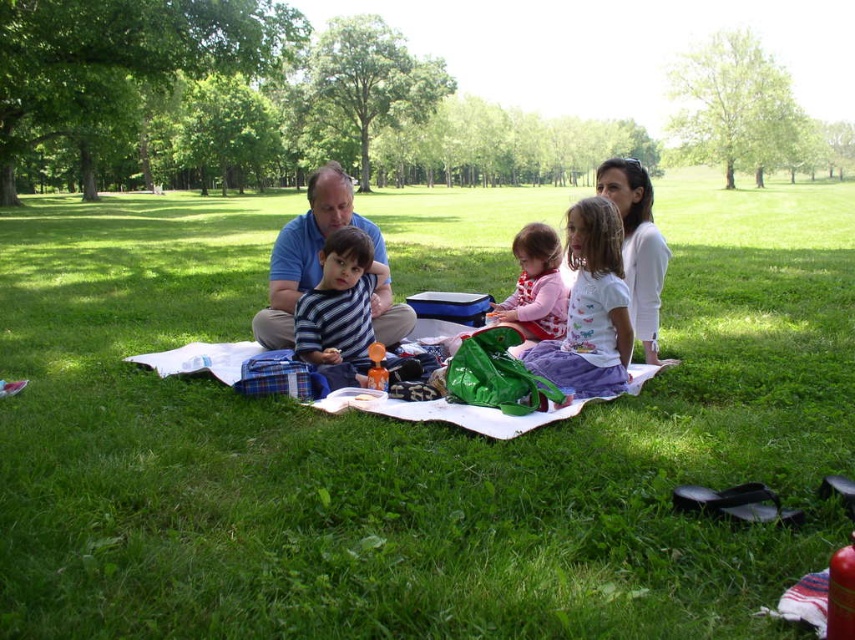
Is blue cotton shirt at center further to camera compared to matte pink shirt at center?

Yes, blue cotton shirt at center is behind matte pink shirt at center.

Can you confirm if blue cotton shirt at center is thinner than matte pink shirt at center?

Yes, blue cotton shirt at center is thinner than matte pink shirt at center.

Where is `blue cotton shirt at center`? This screenshot has width=855, height=640. blue cotton shirt at center is located at coordinates (305, 252).

Between point (576, 237) and point (376, 316), which one is positioned behind?

Point (376, 316)

Can you confirm if purple satin dress at center is shorter than matte blue shirt at center?

Yes.

Does point (594, 355) come farther from viewer compared to point (263, 316)?

No, it is not.

You are a GUI agent. You are given a task and a screenshot of the screen. Output one action in this format:
    pyautogui.click(x=<x>, y=<y>)
    Task: Click on the purple satin dress at center
    The image size is (855, 640).
    Given the screenshot: What is the action you would take?
    pyautogui.click(x=590, y=308)

Is blue cotton shirt at center smaller than matte blue shirt at center?

Correct, blue cotton shirt at center occupies less space than matte blue shirt at center.

Image resolution: width=855 pixels, height=640 pixels. Identify the location of blue cotton shirt at center. (305, 252).